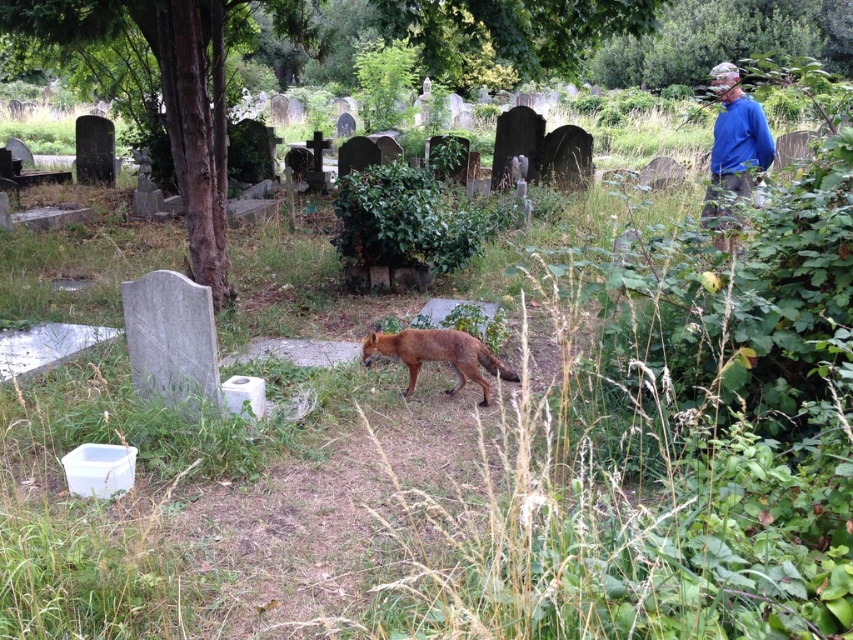
You are a hiker who has lost your way in a forest. You see a green leafy tree at center and a brown fur fox at center. Which object is bigger?

The green leafy tree at center is larger in size than the brown fur fox at center.

You are standing at the edge of the cemetery and see the green leafy tree at center and the brown fur fox at center. Which object is positioned to the left of the other?

The green leafy tree at center is to the left of the brown fur fox at center.

You are a hiker who just entered the cemetery and noticed a brown fur fox at center and a person wearing a blue fleece jacket at upper right. Which object is bigger in size?

The blue fleece jacket at upper right is larger in size than the brown fur fox at center.